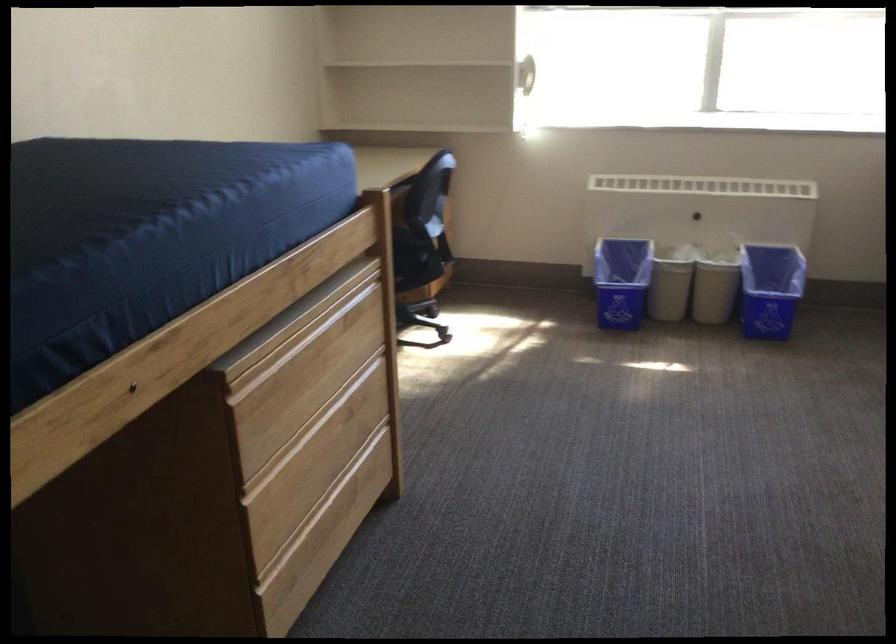
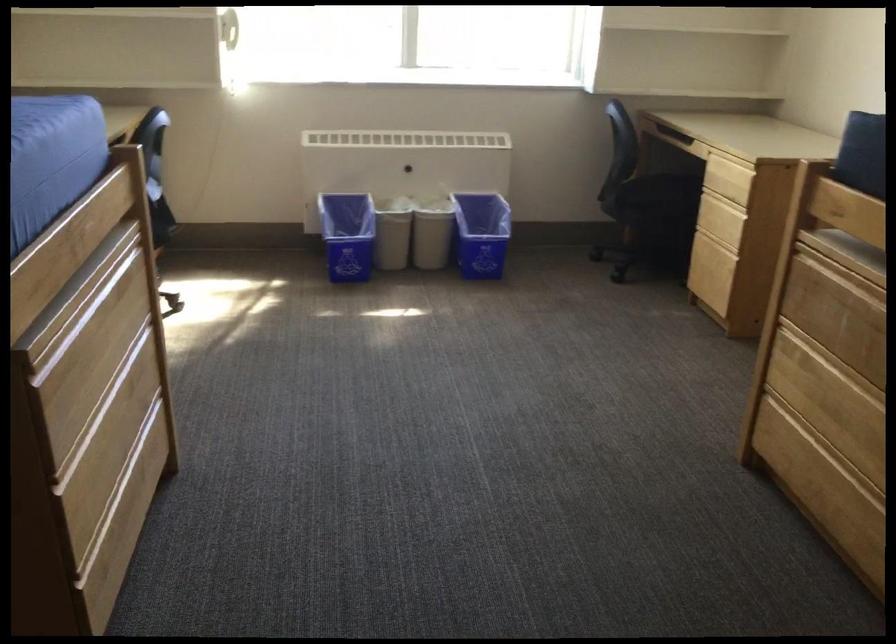
Question: In a continuous first-person perspective shot, in which direction is the camera moving?

Choices:
 (A) Left
 (B) Right
 (C) Forward
 (D) Backward

Answer: (A)